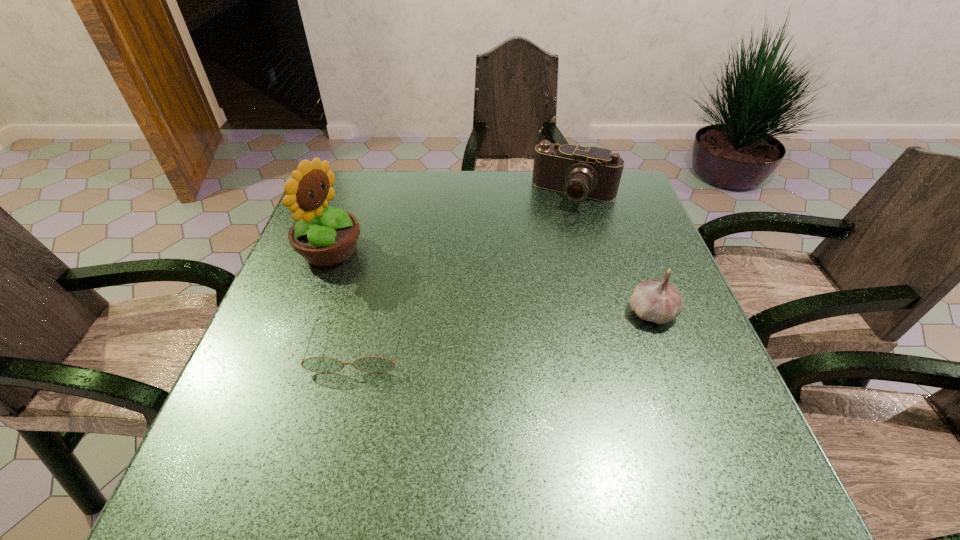
What are the coordinates of `vacant space on the desktop that is between the shortest object and the garlic and is positioned on the front-facing side of the camera` in the screenshot? It's located at (513, 328).

The width and height of the screenshot is (960, 540). I want to click on vacant space on the desktop that is between the sunglasses and the garlic and is positioned on the face of the tallest object, so click(553, 324).